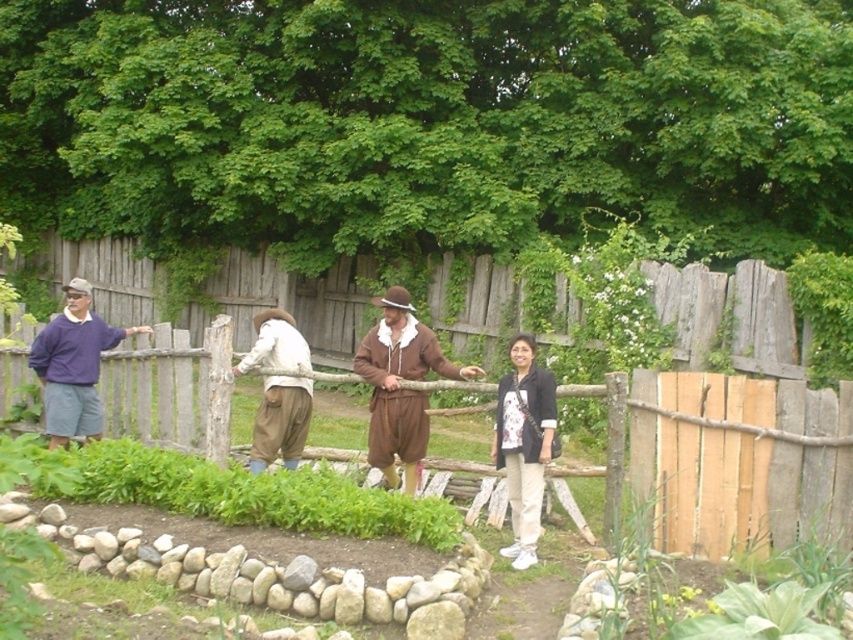
You are a costume designer trying to fit a new jacket over both the brown suede outfit at center and the white cotton pants at center. Which one requires the jacket to be wider to accommodate?

The brown suede outfit at center requires the jacket to be wider because it might be wider than the white cotton pants at center.

You are a costume designer examining the clothing items in the image. Both the white cotton pants at center and the white cotton shirt at center are part of a historical outfit. Which item has a narrower width?

The white cotton pants at center is thinner than the white cotton shirt at center, so the white cotton pants at center has a narrower width.